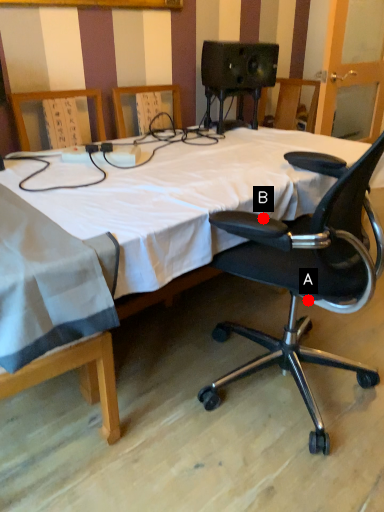
Question: Two points are circled on the image, labeled by A and B beside each circle. Which point is closer to the camera?

Choices:
 (A) A is closer
 (B) B is closer

Answer: (B)